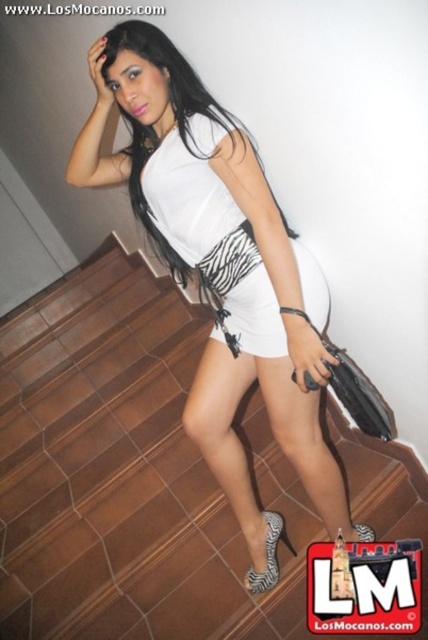
Which of these two, white zebra-patterned shorts at center or zebra print fabric sandal at lower center, stands taller?

white zebra-patterned shorts at center is taller.

Who is higher up, white zebra-patterned shorts at center or zebra print fabric sandal at lower center?

white zebra-patterned shorts at center is higher up.

I want to click on white zebra-patterned shorts at center, so click(x=255, y=316).

Does white zebra-patterned shorts at center appear on the left side of zebra print fabric high-heeled sandal at lower center?

Correct, you'll find white zebra-patterned shorts at center to the left of zebra print fabric high-heeled sandal at lower center.

You are a GUI agent. You are given a task and a screenshot of the screen. Output one action in this format:
    pyautogui.click(x=<x>, y=<y>)
    Task: Click on the white zebra-patterned shorts at center
    The height and width of the screenshot is (640, 428).
    Given the screenshot: What is the action you would take?
    pyautogui.click(x=255, y=316)

Is point (107, 115) positioned after point (226, 314)?

That is True.

Which of these two, white matte tank top at center or white matte zebra print dress at center, stands taller?

Standing taller between the two is white matte tank top at center.

The height and width of the screenshot is (640, 428). I want to click on white matte tank top at center, so click(x=219, y=262).